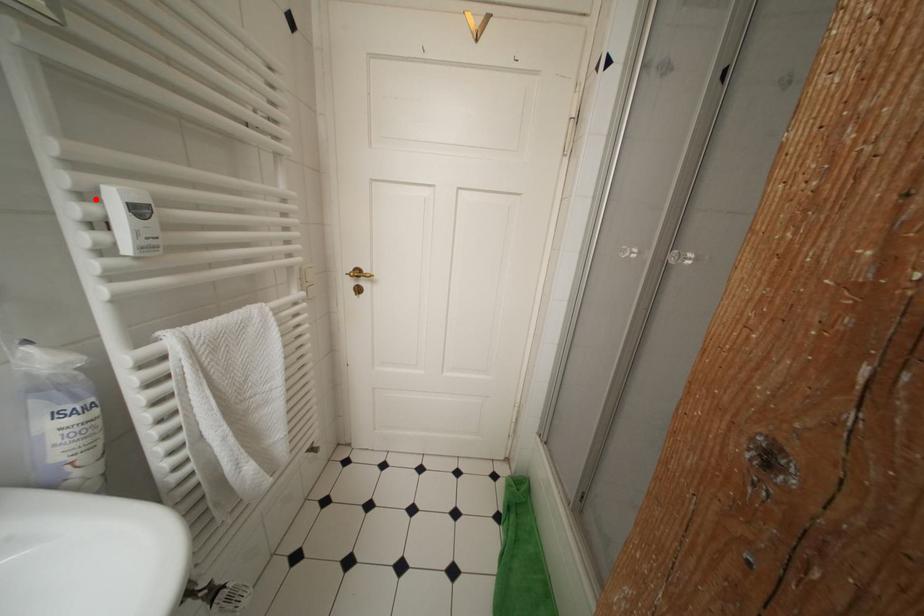
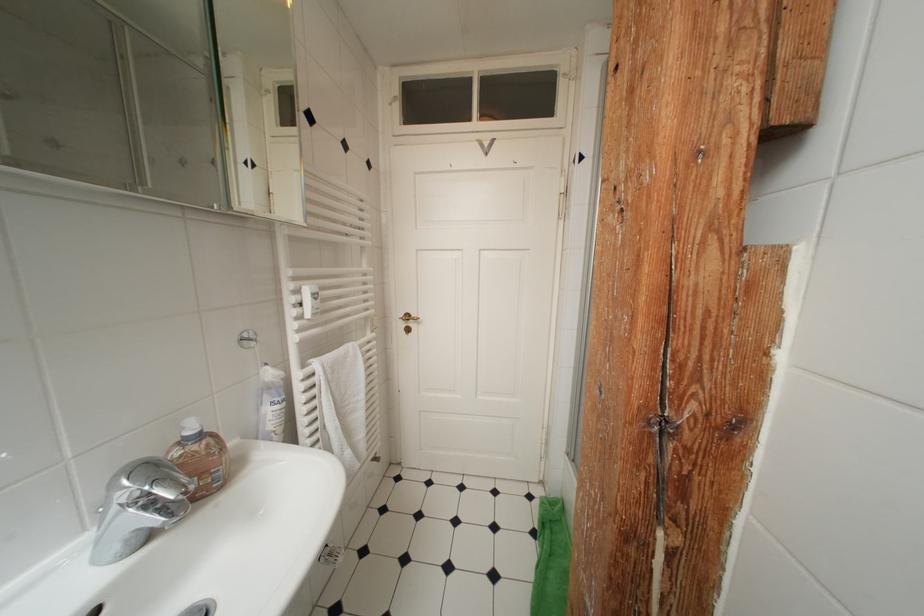
Question: I am providing you with two images of the same scene from different viewpoints. A red point is marked on the first image. At the location where the point appears in image 1, is it still visible in image 2?

Choices:
 (A) Yes
 (B) No

Answer: (A)